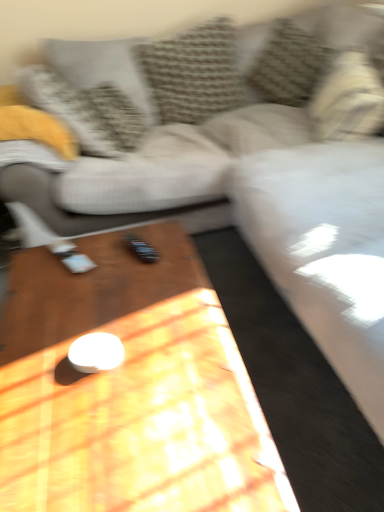
Question: Can textured gray pillow at upper left, the 5th pillow when ordered from right to left, be found inside wooden coffee table at center?

Choices:
 (A) no
 (B) yes

Answer: (A)

Question: From the image's perspective, is wooden coffee table at center below textured gray pillow at upper left, the 5th pillow when ordered from right to left?

Choices:
 (A) yes
 (B) no

Answer: (A)

Question: Does wooden coffee table at center have a smaller size compared to textured gray pillow at upper left, placed as the 1th pillow when sorted from left to right?

Choices:
 (A) no
 (B) yes

Answer: (A)

Question: Is wooden coffee table at center positioned in front of textured gray pillow at upper left, placed as the 1th pillow when sorted from left to right?

Choices:
 (A) no
 (B) yes

Answer: (B)

Question: Is wooden coffee table at center wider than textured gray pillow at upper left, placed as the 1th pillow when sorted from left to right?

Choices:
 (A) yes
 (B) no

Answer: (A)

Question: From a real-world perspective, is textured gray pillow at upper center, which is the 4th pillow in left-to-right order, above or below wooden coffee table at center?

Choices:
 (A) above
 (B) below

Answer: (A)

Question: Is textured gray pillow at upper center, which is the 4th pillow in left-to-right order, wider or thinner than wooden coffee table at center?

Choices:
 (A) thin
 (B) wide

Answer: (A)

Question: Considering the positions of textured gray pillow at upper center, which is the 4th pillow in left-to-right order, and wooden coffee table at center in the image, is textured gray pillow at upper center, which is the 4th pillow in left-to-right order, bigger or smaller than wooden coffee table at center?

Choices:
 (A) small
 (B) big

Answer: (A)

Question: Do you think textured gray pillow at upper center, the 2th pillow in the right-to-left sequence, is within wooden coffee table at center, or outside of it?

Choices:
 (A) inside
 (B) outside

Answer: (B)

Question: Would you say textured gray pillow at upper left, positioned as the second pillow in left-to-right order, is to the left or to the right of textured gray pillow at upper left, the 5th pillow when ordered from right to left, in the picture?

Choices:
 (A) right
 (B) left

Answer: (A)

Question: From a real-world perspective, is textured gray pillow at upper left, the 4th pillow when ordered from right to left, above or below textured gray pillow at upper left, placed as the 1th pillow when sorted from left to right?

Choices:
 (A) below
 (B) above

Answer: (A)

Question: Choose the correct answer: Is textured gray pillow at upper left, the 4th pillow when ordered from right to left, inside textured gray pillow at upper left, placed as the 1th pillow when sorted from left to right, or outside it?

Choices:
 (A) inside
 (B) outside

Answer: (B)

Question: Is textured gray pillow at upper left, positioned as the second pillow in left-to-right order, taller or shorter than textured gray pillow at upper left, the 5th pillow when ordered from right to left?

Choices:
 (A) short
 (B) tall

Answer: (A)

Question: Would you say wooden coffee table at center is to the left or to the right of textured gray pillow at upper left, the 5th pillow when ordered from right to left, in the picture?

Choices:
 (A) left
 (B) right

Answer: (B)

Question: Is point (249, 474) positioned closer to the camera than point (102, 78)?

Choices:
 (A) closer
 (B) farther

Answer: (A)